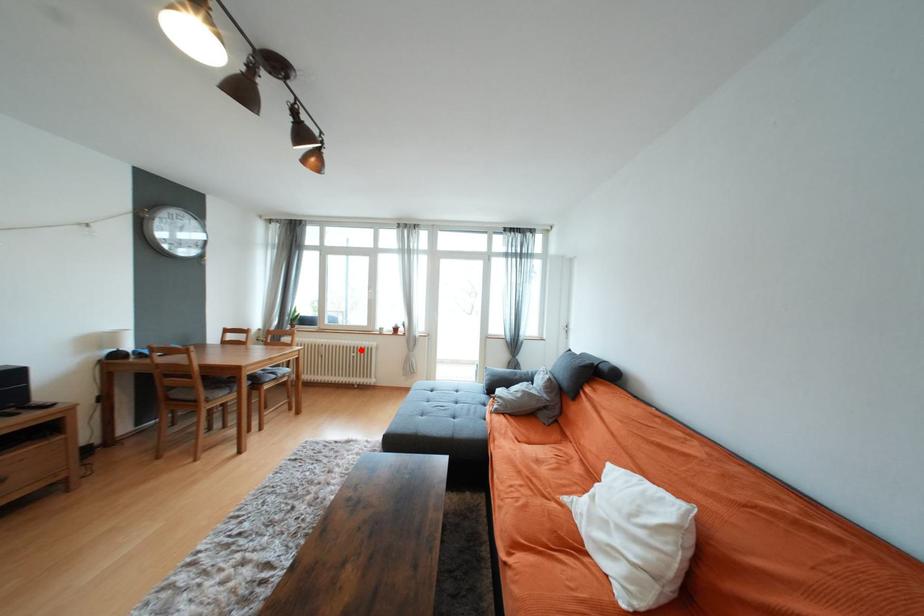
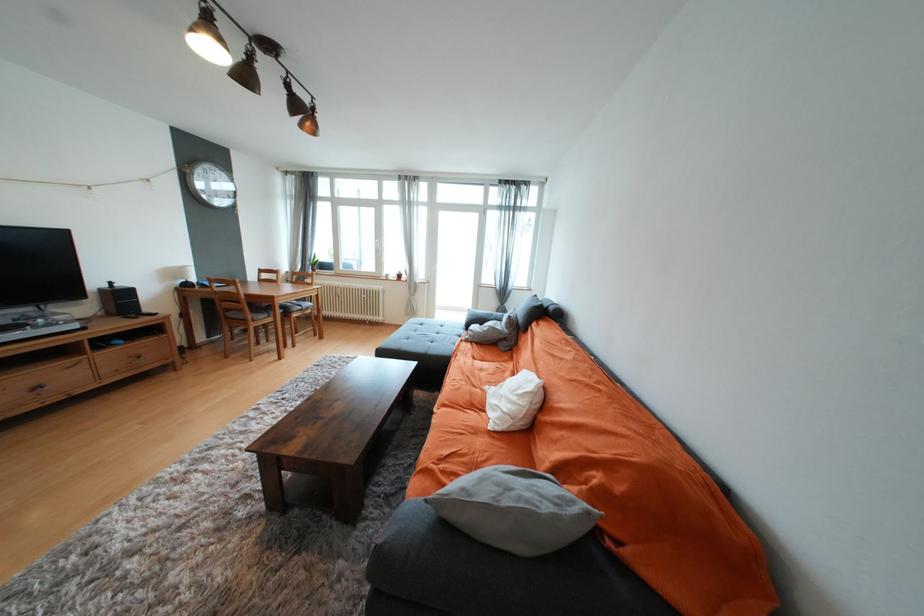
Question: I am providing you with two images of the same scene from different viewpoints. Given a red point in image1, look at the same physical point in image2. Is it:

Choices:
 (A) Closer to the viewpoint
 (B) Farther from the viewpoint

Answer: (A)